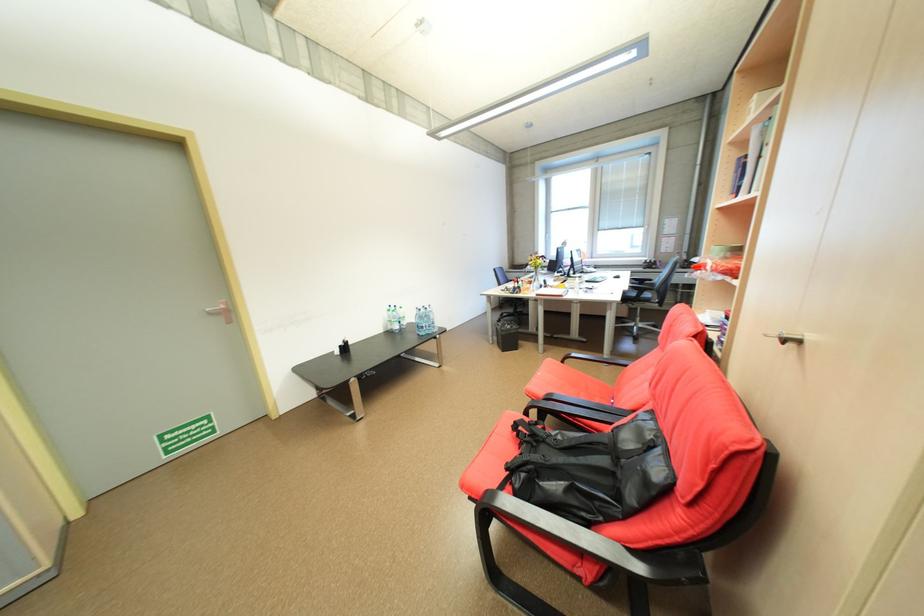
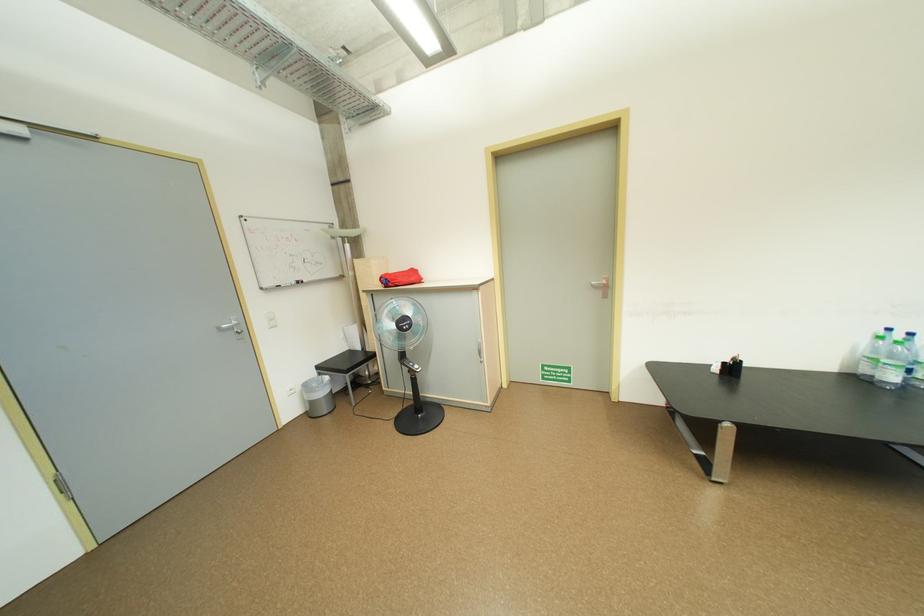
Question: The images are taken continuously from a first-person perspective. In which direction is your viewpoint rotating?

Choices:
 (A) Left
 (B) Right
 (C) Up
 (D) Down

Answer: (A)